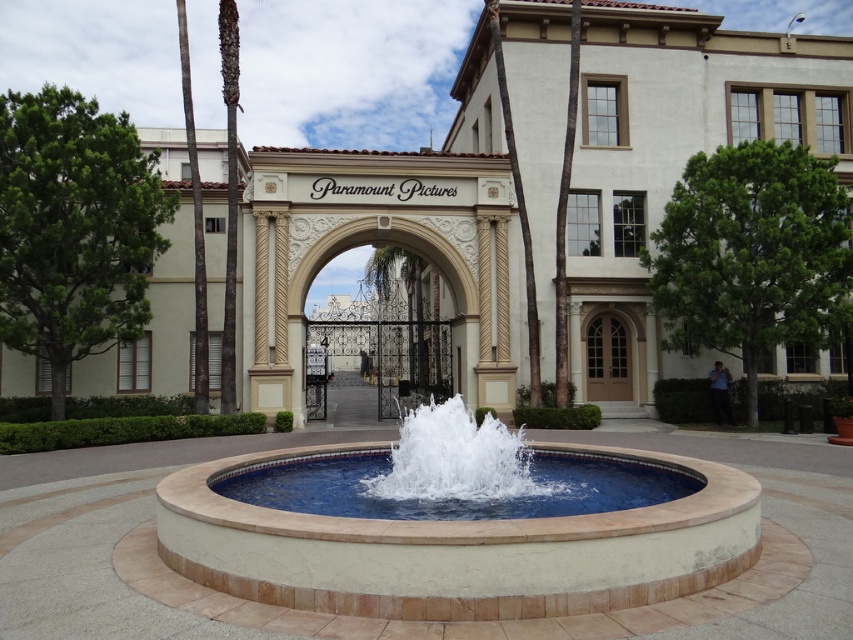
Does white stucco building at center have a greater width compared to green leafy palm tree at left?

Yes, white stucco building at center is wider than green leafy palm tree at left.

Which of these two, white stucco building at center or green leafy palm tree at left, stands shorter?

green leafy palm tree at left is shorter.

Which is in front, point (844, 86) or point (234, 269)?

Positioned in front is point (234, 269).

Where is `white stucco building at center`? This screenshot has height=640, width=853. white stucco building at center is located at coordinates (676, 141).

Does point (218, 240) come closer to viewer compared to point (492, 433)?

No, (218, 240) is behind (492, 433).

From the picture: Which is below, green textured tree at left or clear glass water at center?

clear glass water at center

Identify the location of green textured tree at left. (155, 298).

Can you confirm if green leafy palm tree at left is positioned above brown wooden door at center?

Yes, green leafy palm tree at left is above brown wooden door at center.

Does green leafy palm tree at left have a lesser height compared to brown wooden door at center?

In fact, green leafy palm tree at left may be taller than brown wooden door at center.

Is point (233, 104) positioned in front of point (592, 372)?

Yes, point (233, 104) is closer to viewer.

Find the location of a particular element. green leafy palm tree at left is located at coordinates (229, 195).